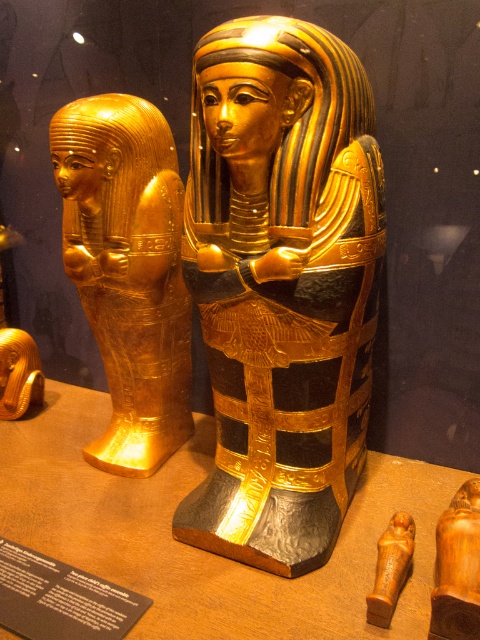
The width and height of the screenshot is (480, 640). What do you see at coordinates (282, 285) in the screenshot? I see `gold/black textured sarcophagus at center` at bounding box center [282, 285].

Does gold/black textured sarcophagus at center lie in front of gold/goldenmaterial/texture sarcophagus at left?

Yes, gold/black textured sarcophagus at center is closer to the viewer.

Who is more forward, [217,365] or [105,269]?

Point [217,365] is in front.

You are a GUI agent. You are given a task and a screenshot of the screen. Output one action in this format:
    pyautogui.click(x=<x>, y=<y>)
    Task: Click on the gold/black textured sarcophagus at center
    This screenshot has width=480, height=640.
    Given the screenshot: What is the action you would take?
    pyautogui.click(x=282, y=285)

Can you confirm if gold/black textured sarcophagus at center is positioned below metallic gold table at center?

No.

Does point (247, 172) lie behind point (26, 448)?

No, it is not.

This screenshot has width=480, height=640. What do you see at coordinates (282, 285) in the screenshot? I see `gold/black textured sarcophagus at center` at bounding box center [282, 285].

At what (x,y) coordinates should I click in order to perform the action: click on gold/black textured sarcophagus at center. Please return your answer as a coordinate pair (x, y). This screenshot has height=640, width=480. Looking at the image, I should click on (282, 285).

Is metallic gold table at center to the right of gold/goldenmaterial/texture sarcophagus at left from the viewer's perspective?

Yes, metallic gold table at center is to the right of gold/goldenmaterial/texture sarcophagus at left.

Could you measure the distance between metallic gold table at center and gold/goldenmaterial/texture sarcophagus at left?

metallic gold table at center is 20.12 inches from gold/goldenmaterial/texture sarcophagus at left.

Is point (351, 552) more distant than point (97, 104)?

That is False.

What are the coordinates of `metallic gold table at center` in the screenshot? It's located at (200, 548).